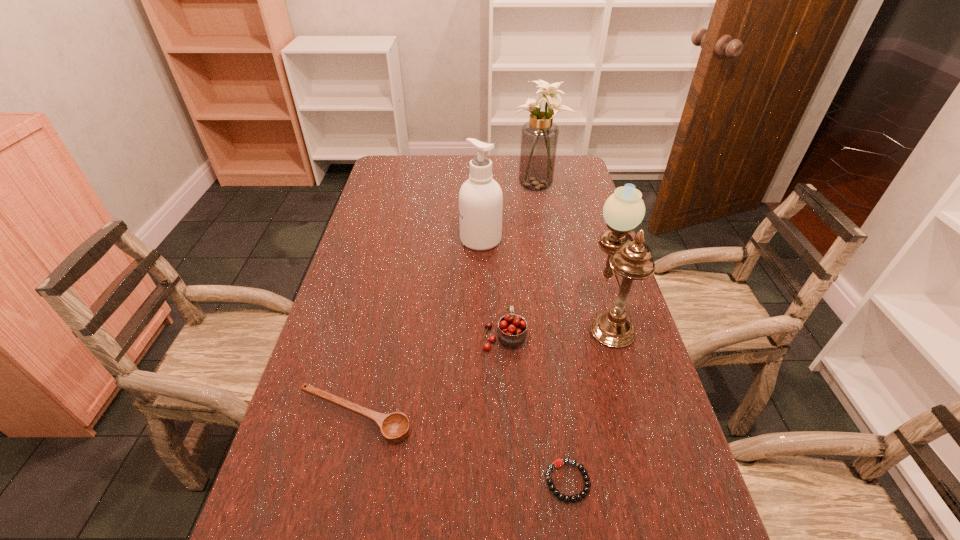
Find the location of a particular element. free space that satisfies the following two spatial constraints: 1. on the back side of the farthest object; 2. on the left side of the bracelet is located at coordinates (524, 184).

What are the coordinates of `free location that satisfies the following two spatial constraints: 1. on the handle side of the fourth tallest object; 2. on the right side of the oil lamp` in the screenshot? It's located at (503, 315).

What are the coordinates of `free spot that satisfies the following two spatial constraints: 1. on the handle side of the flower arrangement; 2. on the left side of the fourth tallest object` in the screenshot? It's located at (496, 184).

In order to click on free point that satisfies the following two spatial constraints: 1. on the front label of the second farthest object; 2. on the front side of the second nearest object in this screenshot , I will do [481, 417].

Where is `blank area in the image that satisfies the following two spatial constraints: 1. on the handle side of the oil lamp; 2. on the right side of the fourth tallest object`? blank area in the image that satisfies the following two spatial constraints: 1. on the handle side of the oil lamp; 2. on the right side of the fourth tallest object is located at coordinates (503, 315).

Image resolution: width=960 pixels, height=540 pixels. Identify the location of free location that satisfies the following two spatial constraints: 1. on the front side of the flower arrangement; 2. on the front label of the cleansing agent. (548, 240).

You are a GUI agent. You are given a task and a screenshot of the screen. Output one action in this format:
    pyautogui.click(x=<x>, y=<y>)
    Task: Click on the blank space that satisfies the following two spatial constraints: 1. on the front side of the fifth farthest object; 2. on the left side of the nearest object
    The width and height of the screenshot is (960, 540).
    Given the screenshot: What is the action you would take?
    pyautogui.click(x=340, y=481)

The image size is (960, 540). Identify the location of free location that satisfies the following two spatial constraints: 1. on the front label of the fifth nearest object; 2. on the handle side of the cherry. (481, 336).